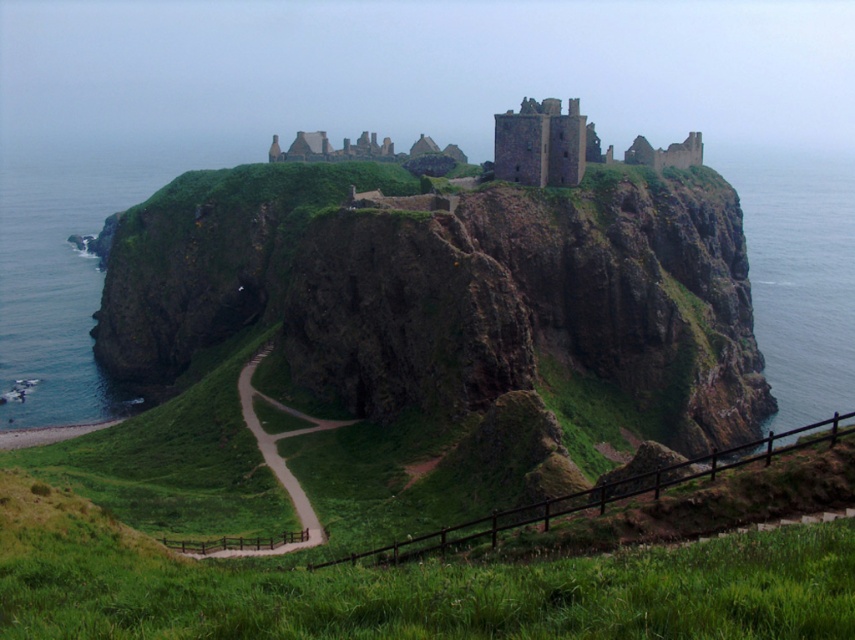
You are standing at the base of the cliff looking up at Dunnottar Castle. You notice two points marked on the cliff face. Which point, point (834, 202) or point (301, 417), is closer to your current position?

Point (834, 202) is further to the viewer than point (301, 417). Therefore, point (301, 417) is closer to your current position.